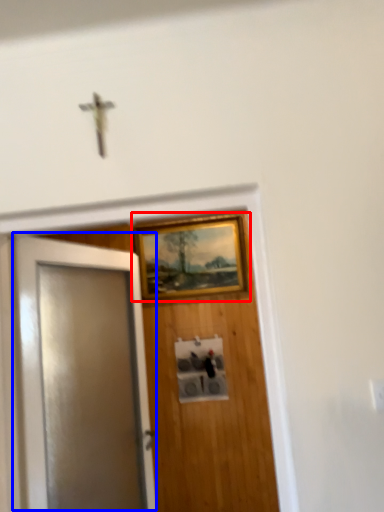
Question: Among these objects, which one is farthest to the camera, picture frame (highlighted by a red box) or door (highlighted by a blue box)?

Choices:
 (A) picture frame
 (B) door

Answer: (A)